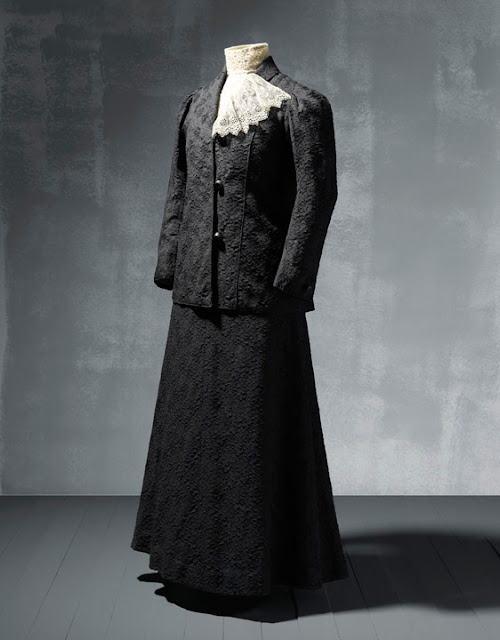
Where is `shadow on floor`? The height and width of the screenshot is (640, 500). shadow on floor is located at coordinates (417, 573).